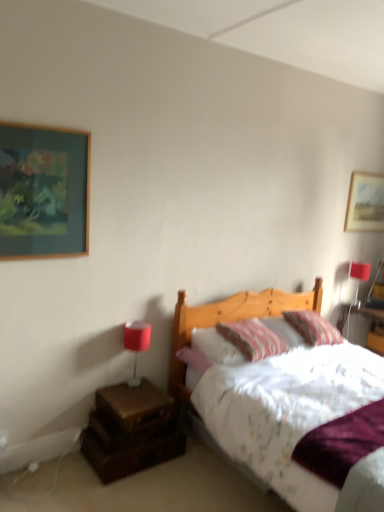
Question: Based on their positions, is brown wooden nightstand at lower left located to the left or right of striped fabric pillow at center, which appears as the second pillow when viewed from the right?

Choices:
 (A) right
 (B) left

Answer: (B)

Question: From a real-world perspective, relative to striped fabric pillow at center, which appears as the second pillow when viewed from the right, is brown wooden nightstand at lower left vertically above or below?

Choices:
 (A) above
 (B) below

Answer: (B)

Question: Which of these objects is positioned closest to the white plastic electric outlet at lower left?

Choices:
 (A) matte red lampshade at upper right, which is the 1th table lamp in top-to-bottom order
 (B) brown wooden nightstand at lower left
 (C) striped fabric pillow at upper right, the second pillow positioned from the left
 (D) wooden picture frame at upper left, which is the 2th picture frame from right to left
 (E) matte red table lamp at left, which appears as the second table lamp when viewed from the back

Answer: (B)

Question: Which of these objects is positioned farthest from the wooden picture frame at upper right, which is the first picture frame in back-to-front order?

Choices:
 (A) striped fabric pillow at center, which appears as the second pillow when viewed from the right
 (B) matte red table lamp at left, the 2th table lamp viewed from the right
 (C) wooden picture frame at upper left, which is the 2th picture frame from right to left
 (D) brown wooden nightstand at lower left
 (E) striped fabric pillow at upper right, acting as the 1th pillow starting from the right

Answer: (C)